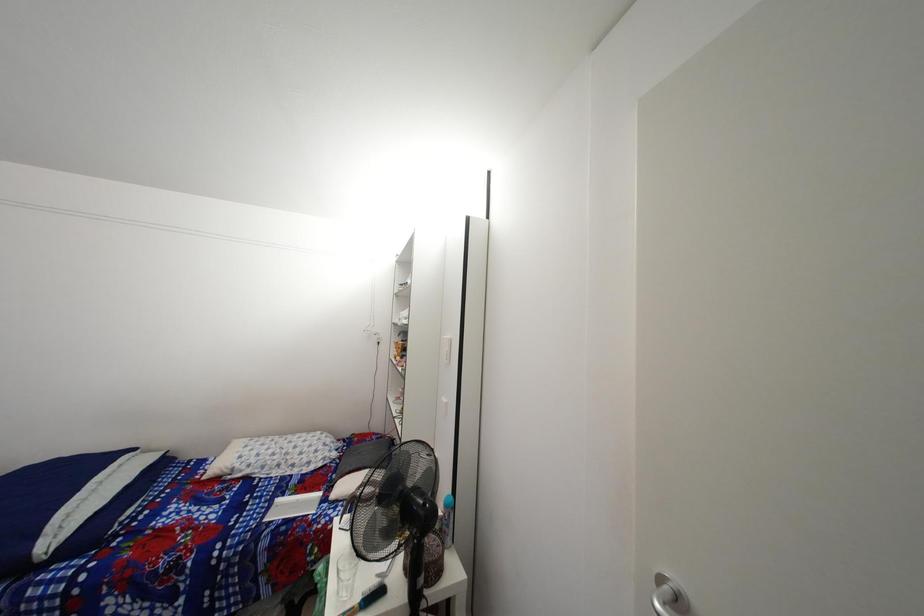
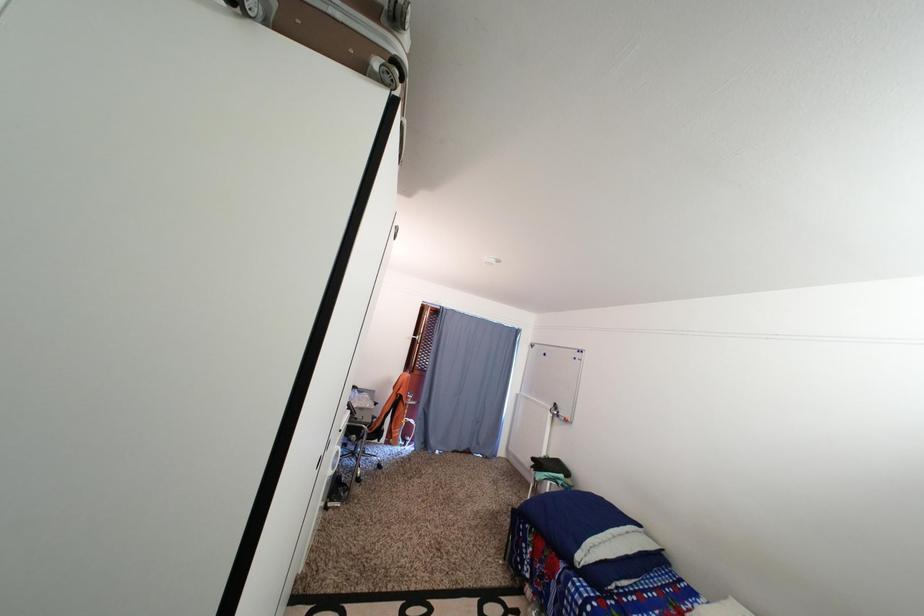
Question: The camera is either moving clockwise (left) or counter-clockwise (right) around the object. The first image is from the beginning of the video and the second image is from the end. Is the camera moving left or right when shooting the video?

Choices:
 (A) Left
 (B) Right

Answer: (B)